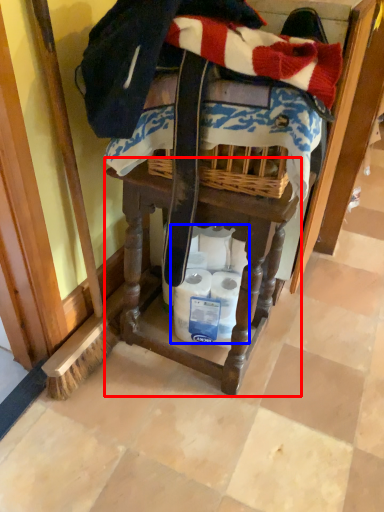
Question: Among these objects, which one is nearest to the camera, vanity (highlighted by a red box) or toilet paper (highlighted by a blue box)?

Choices:
 (A) vanity
 (B) toilet paper

Answer: (A)